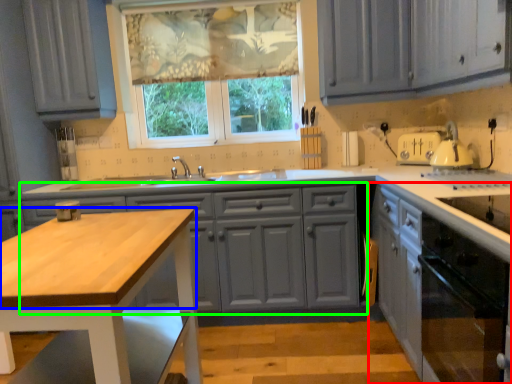
Question: Considering the real-world distances, which object is closest to cabinetry (highlighted by a red box)? countertop (highlighted by a blue box) or cabinetry (highlighted by a green box).

Choices:
 (A) countertop
 (B) cabinetry

Answer: (B)